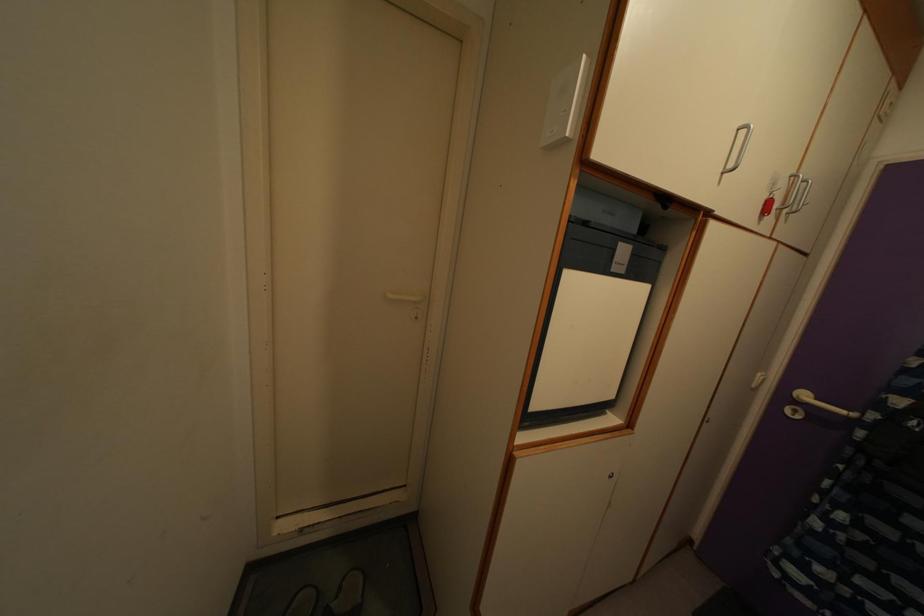
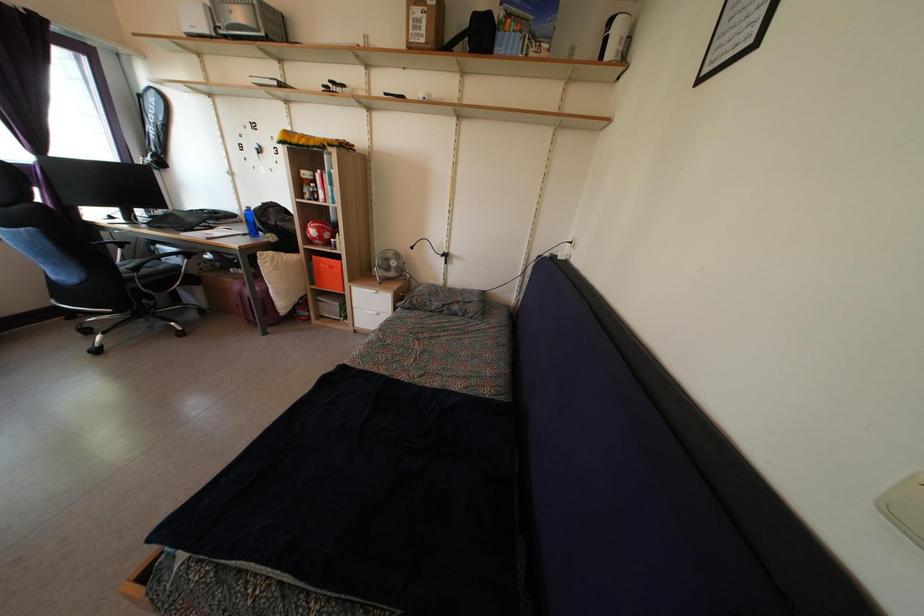
Question: The images are taken continuously from a first-person perspective. In which direction is your viewpoint rotating?

Choices:
 (A) Left
 (B) Right
 (C) Up
 (D) Down

Answer: (A)